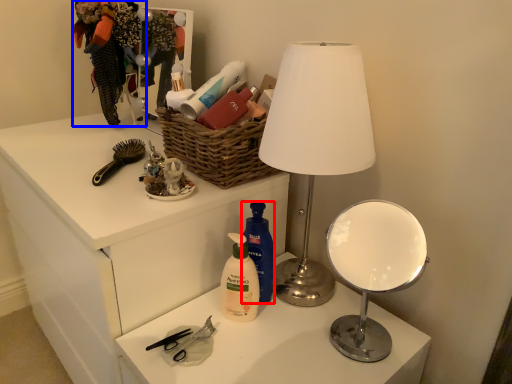
Question: Which object appears farthest to the camera in this image, cleaning product (highlighted by a red box) or clothing (highlighted by a blue box)?

Choices:
 (A) cleaning product
 (B) clothing

Answer: (B)